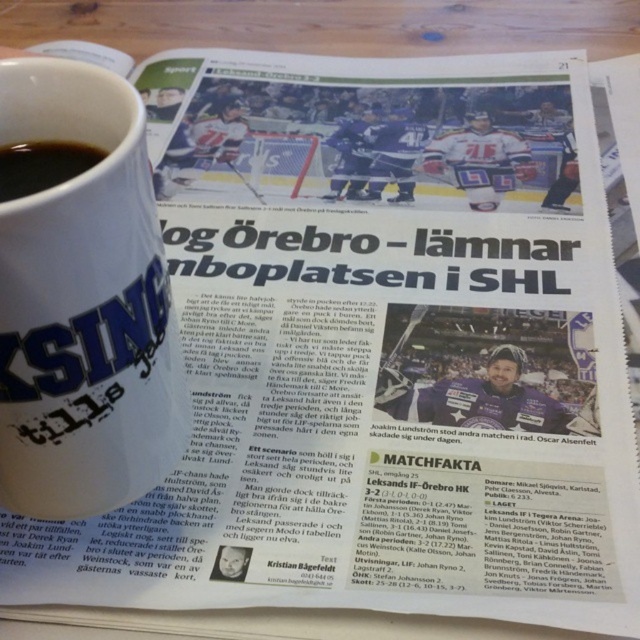
You are a photographer standing at the camera position. You want to take a photo of the newspaper headline without the white matte mug at upper left blocking the view. Can you move the mug to the side so that it won not be in the frame? Explain why or why not.

The white matte mug at upper left is 14.98 inches from the camera. Since the mug is relatively close to the camera, moving it to the side might still keep it within the frame unless moved far enough away. However, without knowing the camera angle or field of view, it is uncertain if moving it sideways would fully remove it from the frame. Alternatively, moving the mug backward or forward could adjust its position in the depth, but the question specifies moving it to the side. Therefore, it depends on how 14

You are organizing a small coffee station and have both the white matte mug at upper left and the black matte cup at upper left. Which one has a larger capacity?

The white matte mug at upper left has a larger capacity since it is wider than the black matte cup at upper left.